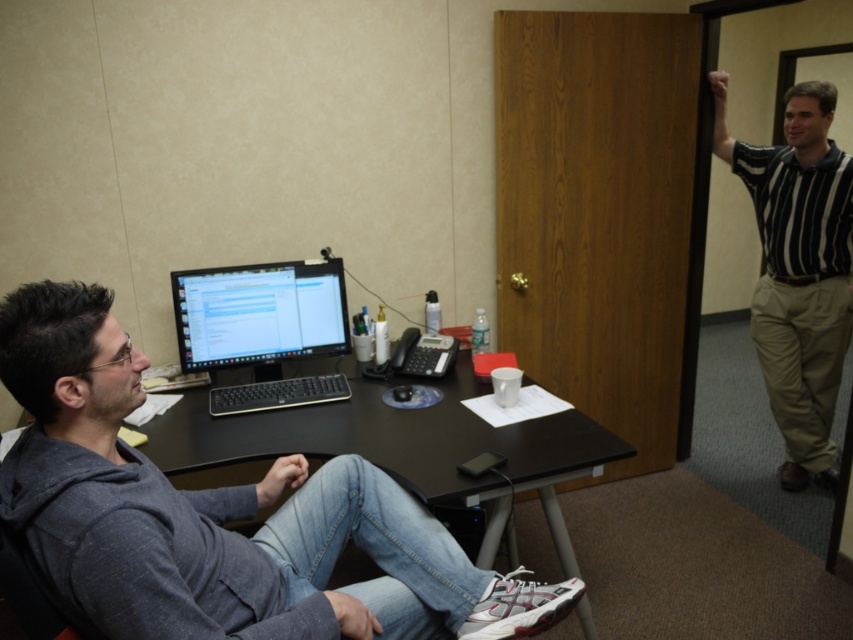
Question: From the image, what is the correct spatial relationship of gray hoodie at left in relation to matte black monitor at center?

Choices:
 (A) left
 (B) right

Answer: (B)

Question: Can you confirm if gray hoodie at left is positioned below matte black monitor at center?

Choices:
 (A) no
 (B) yes

Answer: (B)

Question: Estimate the real-world distances between objects in this image. Which object is farther from the gray hoodie at left?

Choices:
 (A) matte black monitor at center
 (B) striped shirt at right

Answer: (B)

Question: Which point is closer to the camera?

Choices:
 (A) (219, 602)
 (B) (795, 204)

Answer: (A)

Question: Which object appears closest to the camera in this image?

Choices:
 (A) matte black monitor at center
 (B) striped shirt at right
 (C) gray hoodie at left

Answer: (C)

Question: Can you confirm if gray hoodie at left is positioned to the right of striped shirt at right?

Choices:
 (A) no
 (B) yes

Answer: (A)